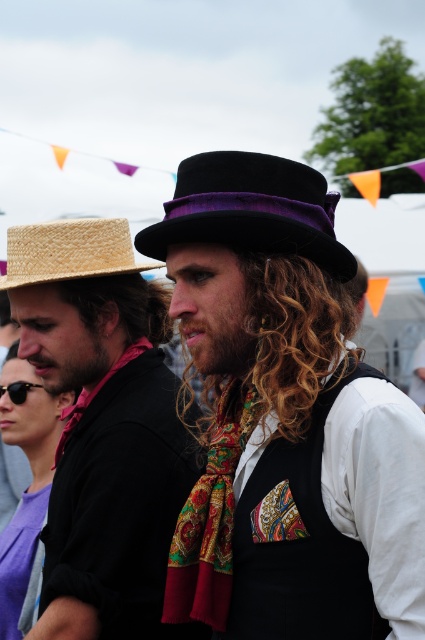
You are a photographer at the festival and want to capture a photo where both the matte straw hat at left and the velvet black fedora at center are clearly visible. Based on their positions, which hat should you focus on first to ensure it appears sharp in the photo?

The matte straw hat at left is below the velvet black fedora at center, so you should focus on the velvet black fedora at center first to ensure it stays sharp while the matte straw hat at left remains in the foreground.

You are a fashion designer measuring the space between two hats for a display. The matte straw hat at left is 12 cm wide and the velvet black fedora at center is 15 cm wide. Can both hats fit side by side on a shelf that is 1 meter long?

The distance between the matte straw hat at left and velvet black fedora at center is 98.17 centimeters. Since the shelf is 1 meter long, which is 100 centimeters, and the combined width of both hats is 12 cm plus 15 cm equals 27 cm, the total required space would be 27 cm. Therefore, both hats can easily fit side by side on the shelf with plenty of space to spare.

You are at a festival and see two people. One has a matte straw hat at left and the other has curly golden hair at center. Which person is positioned to the left?

The matte straw hat at left is to the left of curly golden hair at center, so the person with the matte straw hat at left is positioned to the left.